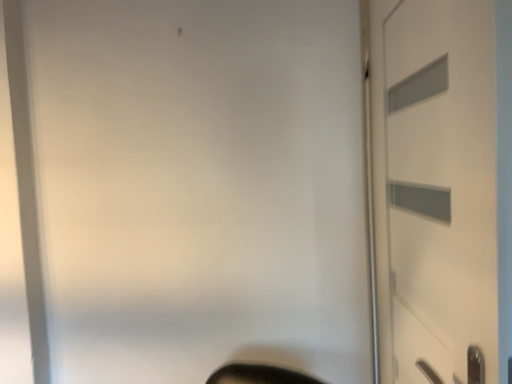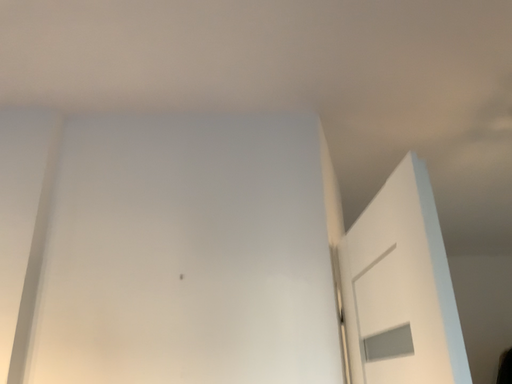
Question: How did the camera likely rotate when shooting the video?

Choices:
 (A) rotated upward
 (B) rotated downward

Answer: (A)